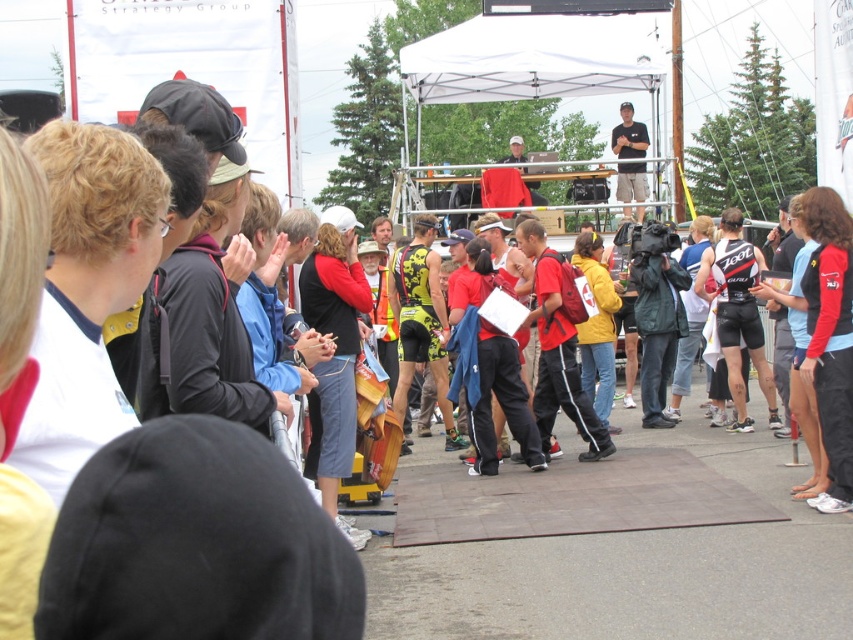
Who is positioned more to the right, white fabric canopy at upper center or black matte shirt at upper center?

black matte shirt at upper center is more to the right.

Consider the image. Is white fabric canopy at upper center to the left of black matte shirt at upper center from the viewer's perspective?

Indeed, white fabric canopy at upper center is positioned on the left side of black matte shirt at upper center.

In order to click on white fabric canopy at upper center in this screenshot , I will do `click(532, 58)`.

The image size is (853, 640). In order to click on white fabric canopy at upper center in this screenshot , I will do `click(532, 58)`.